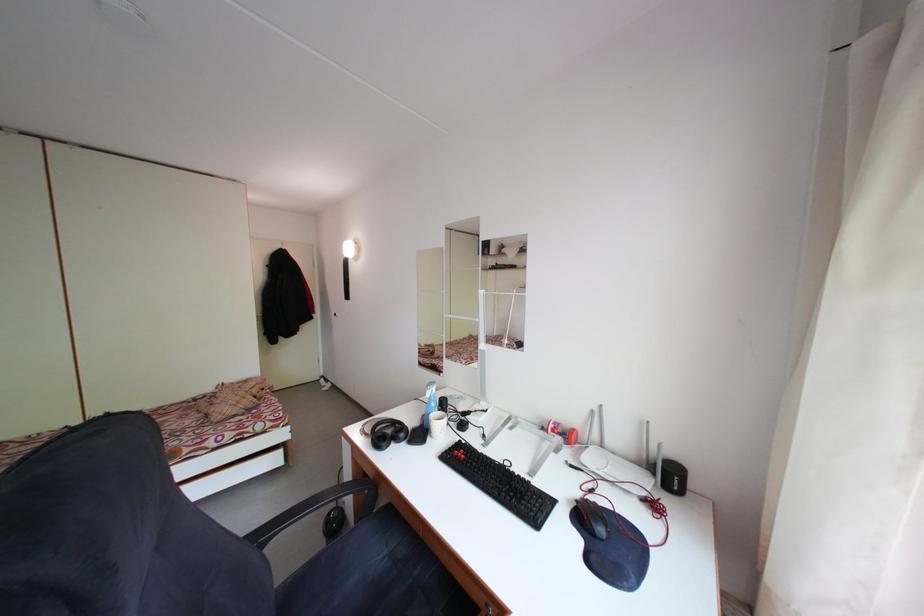
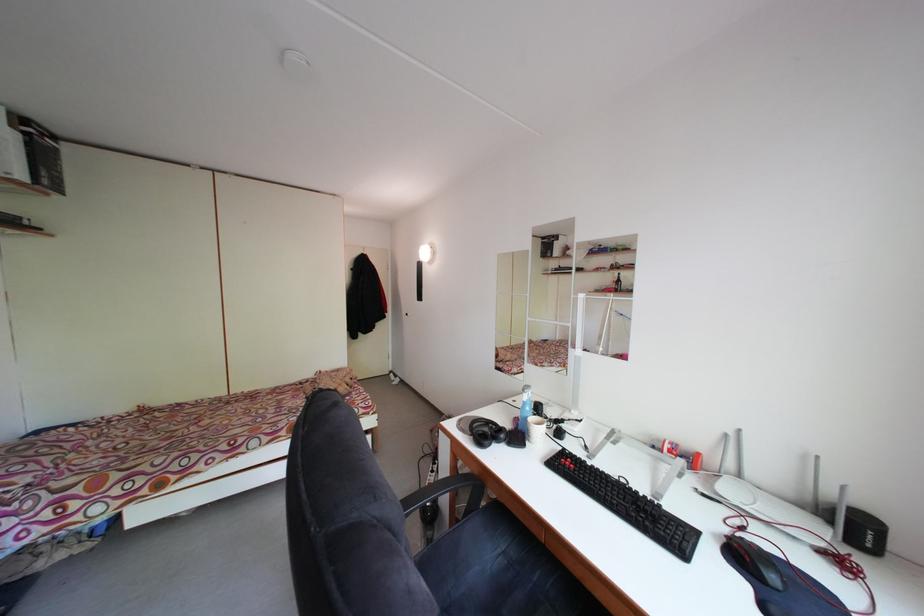
Locate, in the second image, the point that corresponds to (678,483) in the first image.

(865, 535)